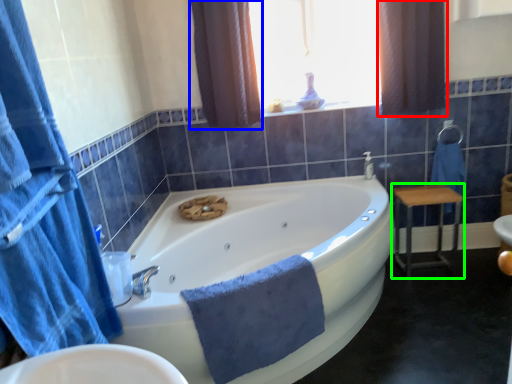
Question: Considering the real-world distances, which object is farthest from curtain (highlighted by a red box)? curtain (highlighted by a blue box) or furniture (highlighted by a green box)?

Choices:
 (A) curtain
 (B) furniture

Answer: (A)